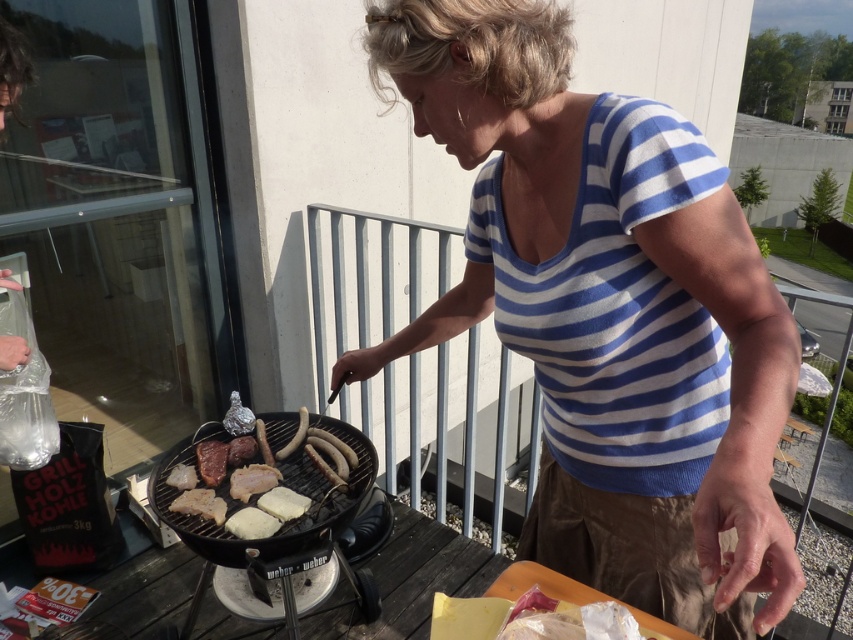
Question: Which object is closer to the camera taking this photo?

Choices:
 (A) grilled meat and sausages at center
 (B) black matte barbecue grill at center

Answer: (B)

Question: Is the position of blue striped shirt at center more distant than that of white matte bread at center?

Choices:
 (A) no
 (B) yes

Answer: (A)

Question: Which object appears closest to the camera in this image?

Choices:
 (A) grilled meat and sausages at center
 (B) white matte bread at center
 (C) blue striped shirt at center
 (D) black matte barbecue grill at center

Answer: (C)

Question: Which of the following is the closest to the observer?

Choices:
 (A) grilled meat and sausages at center
 (B) white matte bread at center
 (C) black matte barbecue grill at center
 (D) blue striped shirt at center

Answer: (D)

Question: Can you confirm if blue striped shirt at center is positioned below grilled meat and sausages at center?

Choices:
 (A) no
 (B) yes

Answer: (A)

Question: Does blue striped shirt at center have a smaller size compared to black matte barbecue grill at center?

Choices:
 (A) no
 (B) yes

Answer: (A)